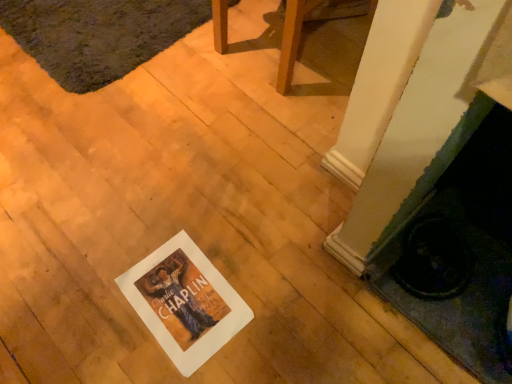
Locate an element on the screen. This screenshot has height=384, width=512. vacant area situated below wooden chair at center (from a real-world perspective) is located at coordinates (279, 42).